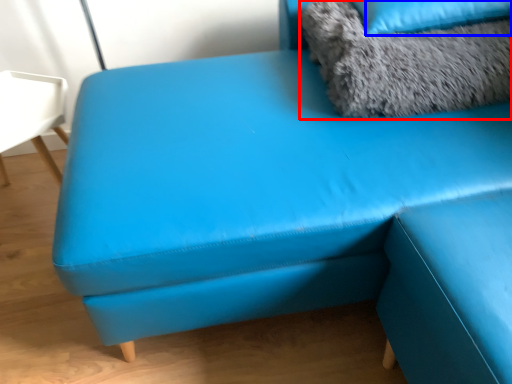
Question: Which of the following is the farthest to the observer, animal (highlighted by a red box) or pillow (highlighted by a blue box)?

Choices:
 (A) animal
 (B) pillow

Answer: (B)